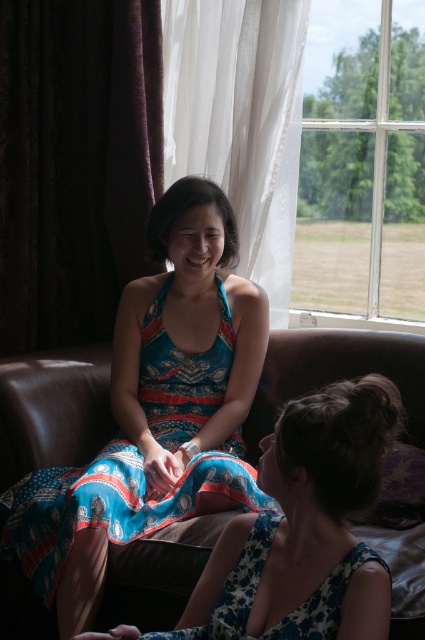
Question: Which object is closer to the camera taking this photo?

Choices:
 (A) blue printed dress at center
 (B) clear glass window at upper right

Answer: (A)

Question: Does dark velvet curtain at left come in front of clear glass window at upper right?

Choices:
 (A) no
 (B) yes

Answer: (B)

Question: Does brown leather couch at center lie in front of blue printed dress at center?

Choices:
 (A) no
 (B) yes

Answer: (A)

Question: Which object appears closest to the camera in this image?

Choices:
 (A) dark velvet curtain at left
 (B) blue printed dress at center
 (C) clear glass window at upper right

Answer: (B)

Question: Which of the following is the farthest from the observer?

Choices:
 (A) (215, 616)
 (B) (348, 337)

Answer: (B)

Question: Can you confirm if brown leather couch at center is positioned to the right of clear glass window at upper right?

Choices:
 (A) no
 (B) yes

Answer: (A)